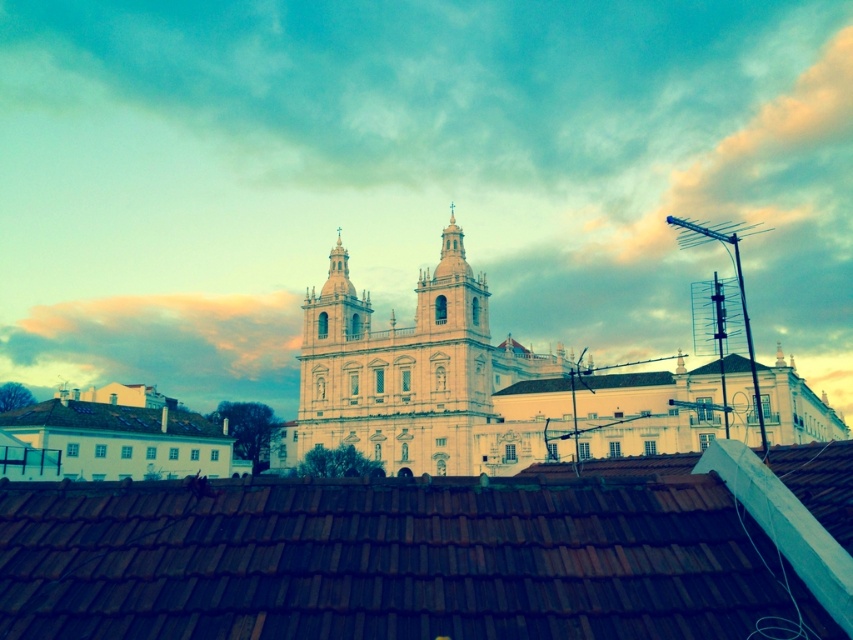
Looking at this image, you are standing in front of the grand historic building. You notice the white smooth church at center and the white shingles at lower left. Which object is nearer to you?

The white smooth church at center is closer to the viewer than the white shingles at lower left.

Looking at the grand historic building with its two domed towers, you notice the cloudy sky at upper center and the pastel pink cloud at upper center. Which of these two objects is positioned to the right?

The cloudy sky at upper center is to the right of the pastel pink cloud at upper center.

You are standing in front of the grand historic building and want to take a photo. You have two points marked on your camera screen at coordinates point (523, 157) and point (260, 337). Which point is closer to you?

Point (523, 157) is further to the viewer than point (260, 337), so the point closer to you is point (260, 337).